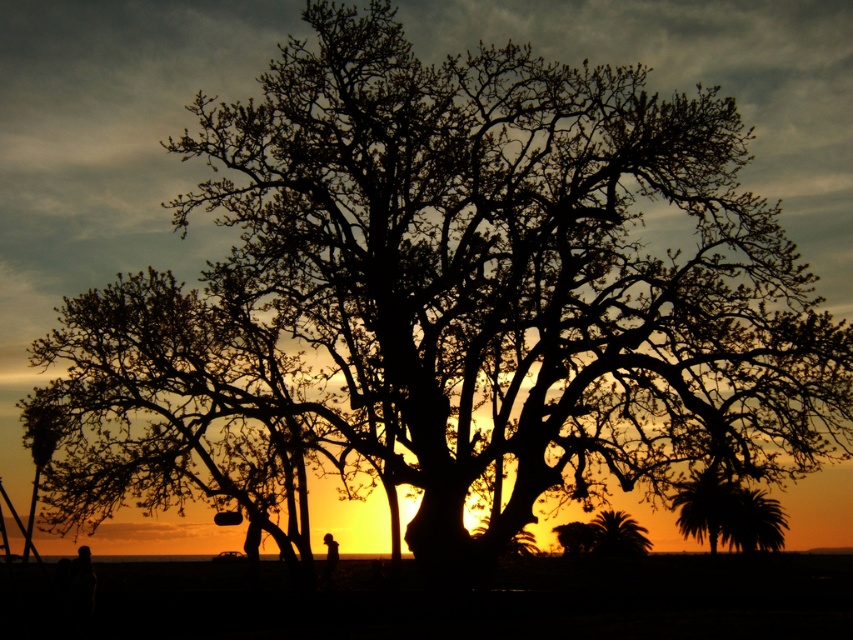
Based on the photo, who is positioned more to the right, black matte person at lower center or black silhouette person at center?

From the viewer's perspective, black silhouette person at center appears more on the right side.

Who is shorter, black matte person at lower center or black silhouette person at center?

Standing shorter between the two is black silhouette person at center.

Locate an element on the screen. The height and width of the screenshot is (640, 853). black matte person at lower center is located at coordinates click(x=252, y=540).

Locate an element on the screen. The height and width of the screenshot is (640, 853). black matte person at lower center is located at coordinates (252, 540).

Between green leafy palm at right and black silhouette person at center, which one has less height?

With less height is black silhouette person at center.

Looking at this image, is green leafy palm at right shorter than black silhouette person at center?

No, green leafy palm at right is not shorter than black silhouette person at center.

Image resolution: width=853 pixels, height=640 pixels. I want to click on green leafy palm at right, so click(728, 513).

I want to click on green leafy palm at right, so click(x=728, y=513).

Can you confirm if green leafy palm at right is positioned below black matte person at lower center?

Indeed, green leafy palm at right is positioned under black matte person at lower center.

Identify the location of green leafy palm at right. This screenshot has width=853, height=640. (728, 513).

Identify the location of green leafy palm at right. The width and height of the screenshot is (853, 640). (728, 513).